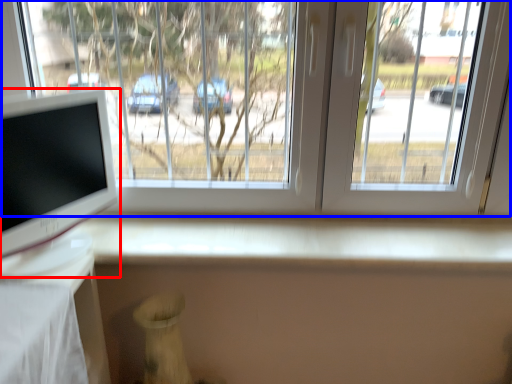
Question: Which object appears closest to the camera in this image, computer monitor (highlighted by a red box) or window (highlighted by a blue box)?

Choices:
 (A) computer monitor
 (B) window

Answer: (A)